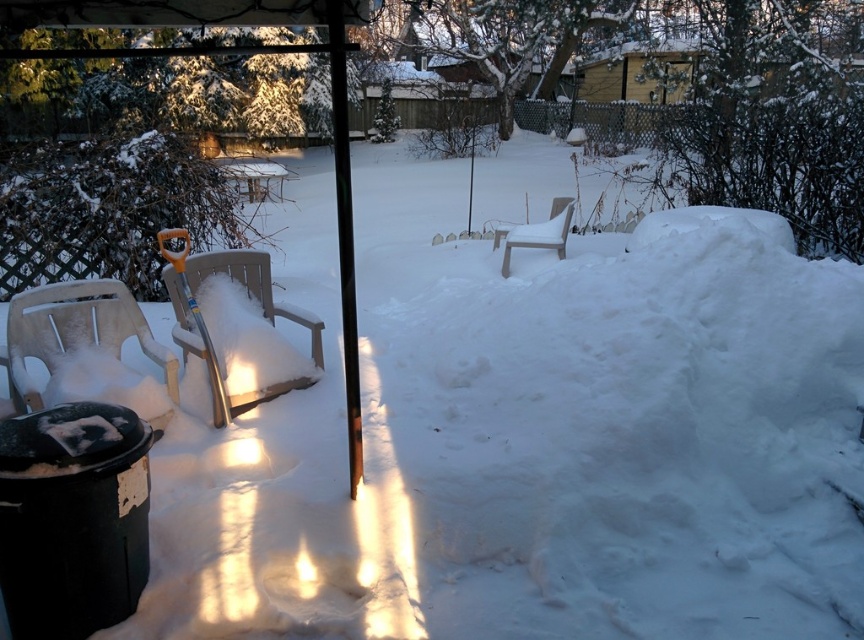
You are trying to decide whether to use the plastic chair at left or the teal plastic shovel at center to move a heavy box. Which object is more suitable for this task based on their sizes?

The plastic chair at left is bigger than the teal plastic shovel at center, so it is more suitable for moving a heavy box.